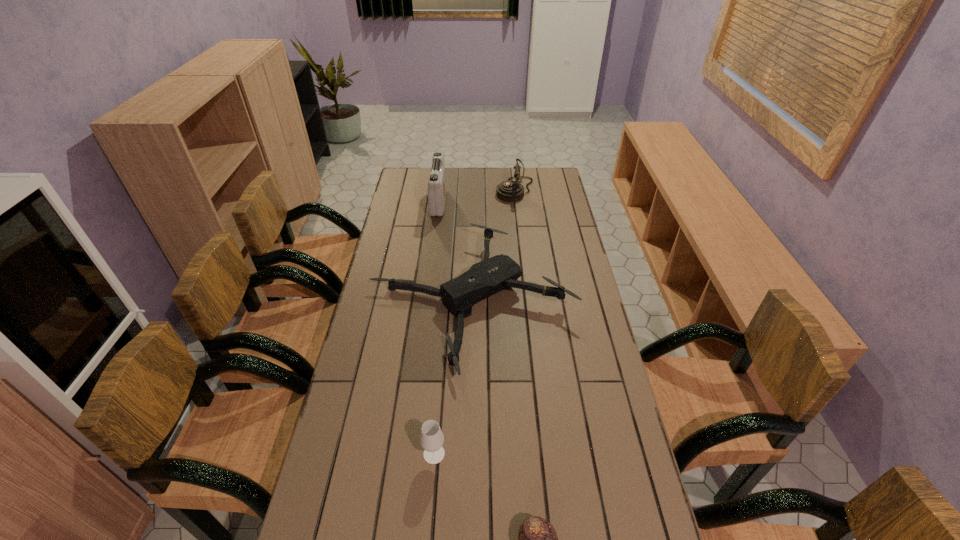
Find the location of a particular element. The image size is (960, 540). the first-aid kit is located at coordinates (437, 180).

Find the location of `telephone`. telephone is located at coordinates (510, 191).

The height and width of the screenshot is (540, 960). I want to click on the fourth farthest object, so click(x=431, y=439).

This screenshot has width=960, height=540. Find the location of `the third farthest object`. the third farthest object is located at coordinates (492, 275).

At what (x,y) coordinates should I click in order to perform the action: click on drone. Please return your answer as a coordinate pair (x, y). The height and width of the screenshot is (540, 960). Looking at the image, I should click on (492, 275).

Locate an element on the screen. The width and height of the screenshot is (960, 540). free point located on the front side of the first-aid kit is located at coordinates (472, 204).

Find the location of a particular element. The height and width of the screenshot is (540, 960). vacant space situated on the left of the telephone is located at coordinates (433, 190).

This screenshot has height=540, width=960. Find the location of `vacant space located on the front of the fourth farthest object`. vacant space located on the front of the fourth farthest object is located at coordinates (431, 494).

Find the location of a particular element. vacant area situated 0.050m on the right of the third nearest object is located at coordinates (588, 302).

Where is `the first-aid kit that is at the far edge`? This screenshot has width=960, height=540. the first-aid kit that is at the far edge is located at coordinates (437, 180).